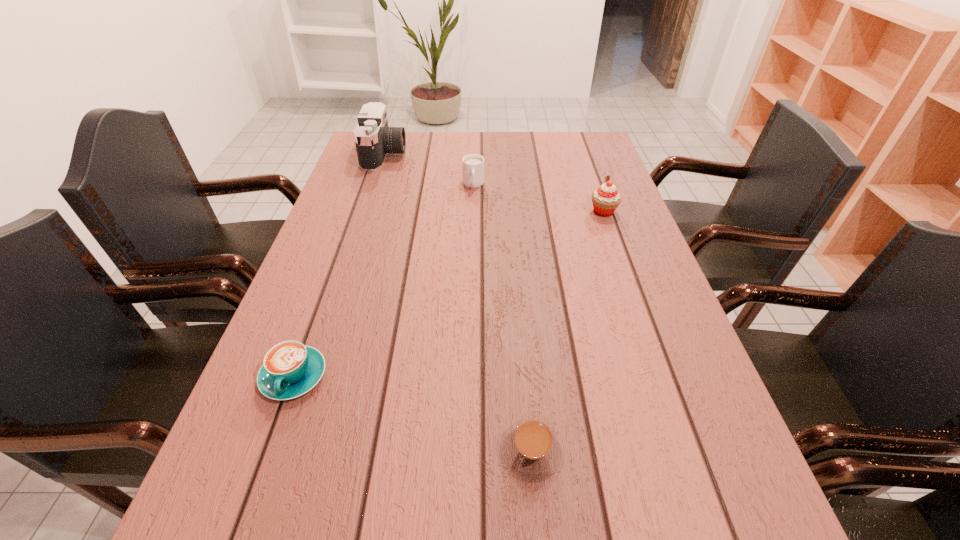
Image resolution: width=960 pixels, height=540 pixels. I want to click on the farthest object, so click(374, 139).

The height and width of the screenshot is (540, 960). Identify the location of the tallest object. (374, 139).

The image size is (960, 540). What are the coordinates of `cupcake` in the screenshot? It's located at (605, 199).

The image size is (960, 540). What are the coordinates of `the second tallest object` in the screenshot? It's located at (605, 199).

Where is `the farthest cappuccino`? Image resolution: width=960 pixels, height=540 pixels. the farthest cappuccino is located at coordinates (473, 164).

Identify the location of the third tallest object. The height and width of the screenshot is (540, 960). (473, 164).

Identify the location of the second nearest object. (290, 369).

This screenshot has height=540, width=960. What are the coordinates of `the second nearest cappuccino` in the screenshot? It's located at (290, 369).

The width and height of the screenshot is (960, 540). Identify the location of the fourth object from left to right. (531, 449).

Find the location of `the rightmost cappuccino`. the rightmost cappuccino is located at coordinates (531, 449).